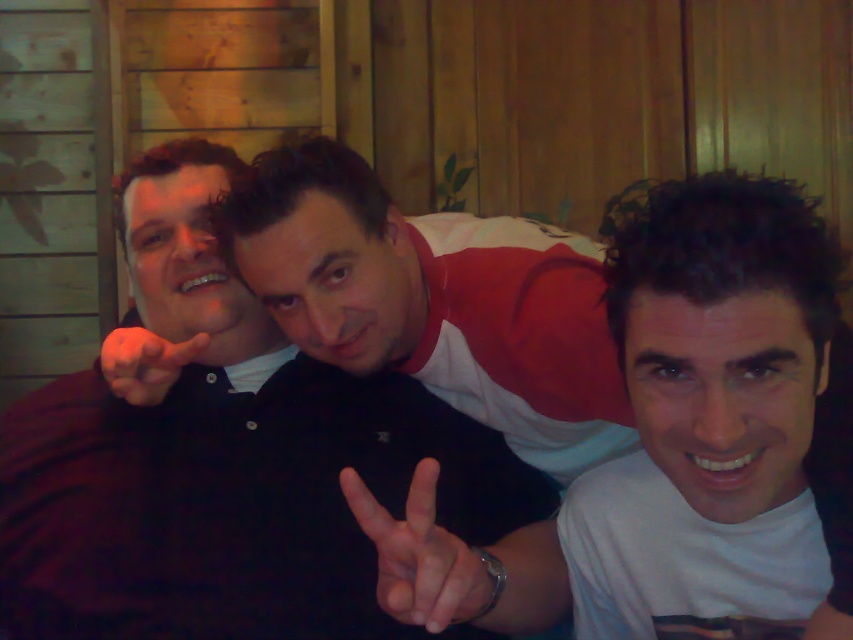
Question: Does white matte shirt at center come behind white matte hand at center?

Choices:
 (A) yes
 (B) no

Answer: (A)

Question: Does black matte shirt at center appear under white matte hand at center?

Choices:
 (A) yes
 (B) no

Answer: (B)

Question: Which point is closer to the camera taking this photo?

Choices:
 (A) pos(143,381)
 (B) pos(62,593)
 (C) pos(631,353)

Answer: (C)

Question: Which object is the closest to the white matte hand at center?

Choices:
 (A) black matte shirt at center
 (B) white matte shirt at center
 (C) smooth skin hand at center

Answer: (B)

Question: Does black matte shirt at center appear on the right side of white matte shirt at center?

Choices:
 (A) no
 (B) yes

Answer: (A)

Question: Among these objects, which one is nearest to the camera?

Choices:
 (A) white matte shirt at center
 (B) white matte hand at center
 (C) black matte shirt at center

Answer: (B)